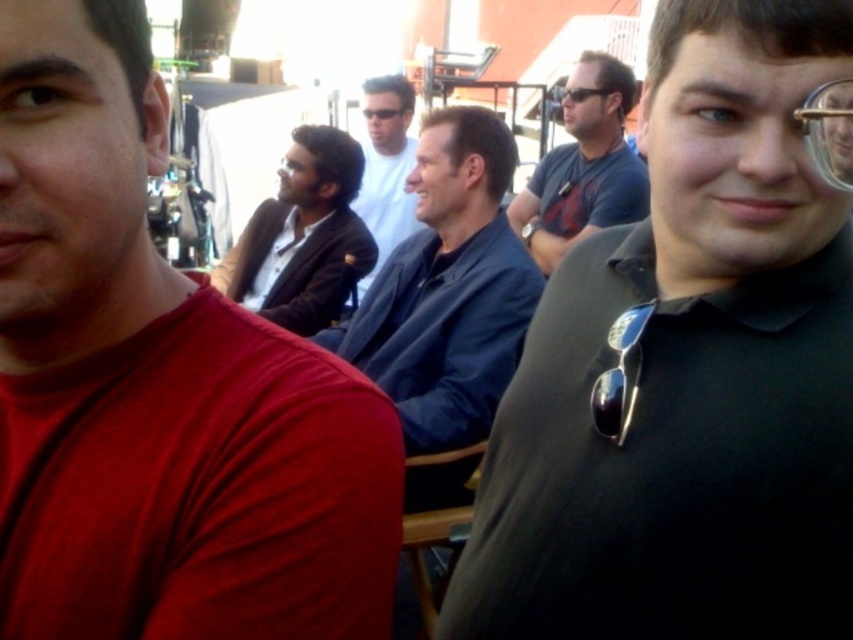
Question: Where is blue fabric jacket at center located in relation to gold metallic goggles at upper right in the image?

Choices:
 (A) above
 (B) below

Answer: (B)

Question: Which is farther from the black matte shirt at right?

Choices:
 (A) matte red shirt at left
 (B) black plastic sunglasses at center

Answer: (B)

Question: Among these objects, which one is nearest to the camera?

Choices:
 (A) black matte shirt at right
 (B) matte red shirt at left
 (C) gold metallic goggles at upper right

Answer: (B)

Question: Does black matte shirt at right come in front of blue fabric jacket at center?

Choices:
 (A) yes
 (B) no

Answer: (A)

Question: Among these points, which one is farthest from the camera?

Choices:
 (A) [339, 282]
 (B) [389, 145]
 (C) [846, 99]
 (D) [590, 93]

Answer: (B)

Question: Considering the relative positions of matte red shirt at left and sunglasses at right in the image provided, where is matte red shirt at left located with respect to sunglasses at right?

Choices:
 (A) above
 (B) below

Answer: (A)